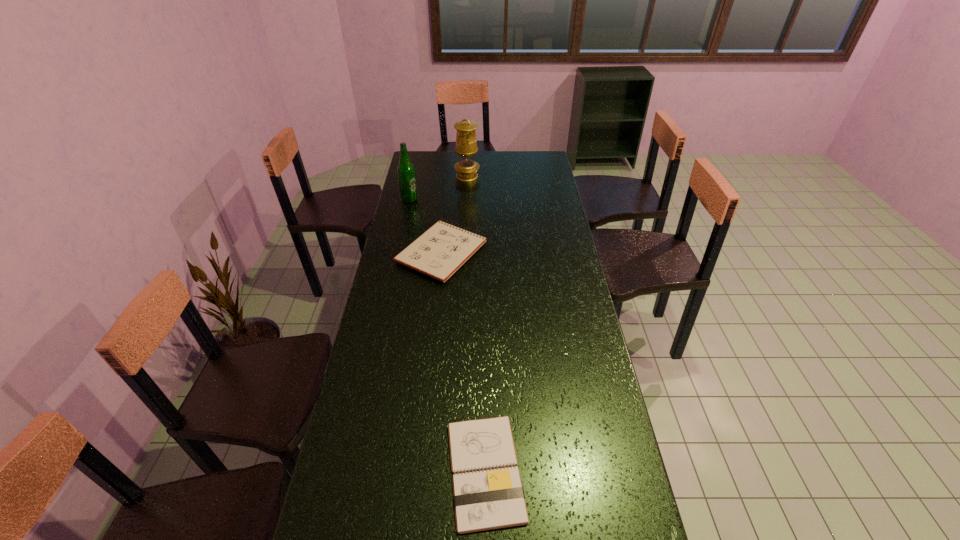
What are the coordinates of `object present at the far edge` in the screenshot? It's located at (466, 145).

Find the location of `beer bottle located at the left edge`. beer bottle located at the left edge is located at coordinates (406, 172).

This screenshot has height=540, width=960. In order to click on notepad that is at the left edge in this screenshot , I will do `click(439, 252)`.

Find the location of `vacant area at the far edge of the desktop`. vacant area at the far edge of the desktop is located at coordinates (444, 171).

This screenshot has width=960, height=540. Identify the location of free space at the left edge of the desktop. (428, 199).

In the image, there is a desktop. In order to click on vacant area at the right edge in this screenshot , I will do `click(575, 368)`.

Find the location of a particular element. The image size is (960, 540). vacant space at the far right corner is located at coordinates (524, 156).

This screenshot has width=960, height=540. Identify the location of free space between the second farthest object and the second nearest object. (426, 226).

This screenshot has height=540, width=960. Identify the location of free area in between the farther notepad and the nearer notepad. (464, 361).

You are a GUI agent. You are given a task and a screenshot of the screen. Output one action in this format:
    pyautogui.click(x=<x>, y=<y>)
    Task: Click on the vacant space in between the third nearest object and the nearer notepad
    This screenshot has height=540, width=960.
    Given the screenshot: What is the action you would take?
    pyautogui.click(x=447, y=335)